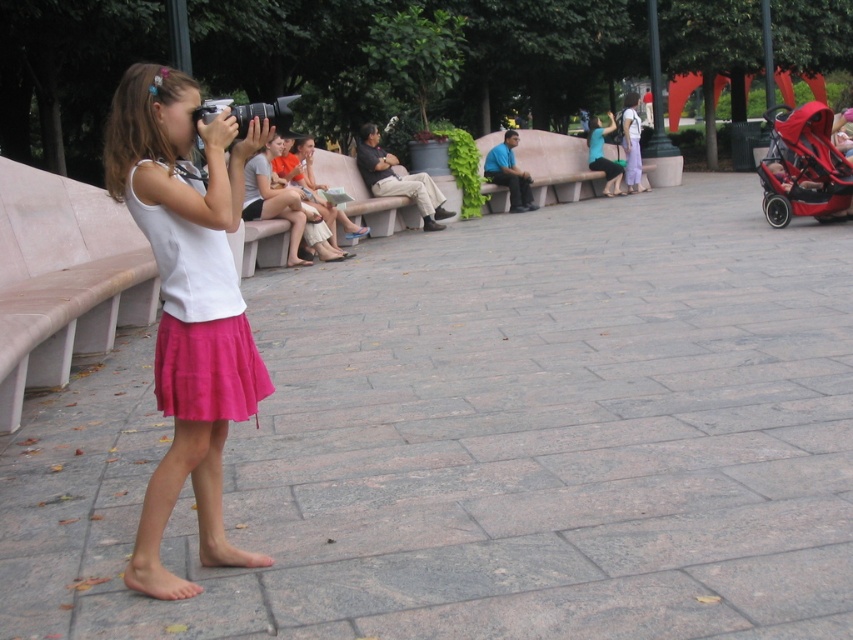
You are a photographer trying to capture a photo of the matte white blouse at center without the red matte baby carriage at right blocking the view. Can you adjust your position to do so?

The red matte baby carriage at right is closer to the viewer than the matte white blouse at center, so moving your position slightly to the left or right might allow you to angle around the carriage and still capture the blouse without obstruction.

You are a photographer at the park and want to focus on the blue fabric shirt at center and the purple cotton dress at center. Which one is nearer to you?

The blue fabric shirt at center is closer to the viewer than the purple cotton dress at center.

You are a fashion designer observing the scene. You notice the pink satin skirt at left and the matte teal blouse at center. Which clothing item appears taller in the image?

The pink satin skirt at left is much taller than the matte teal blouse at center in the image.